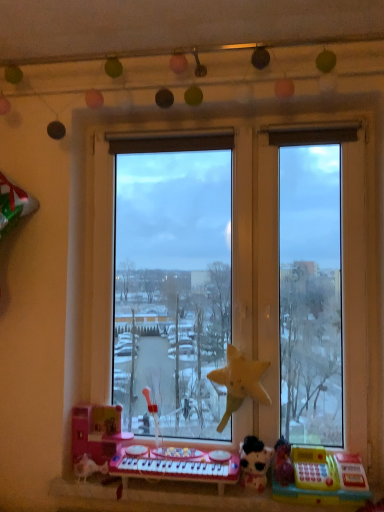
Find the location of a particular element. Image resolution: width=384 pixels, height=512 pixels. blank space situated above pink plastic musical keyboard at lower center (from a real-world perspective) is located at coordinates (184, 453).